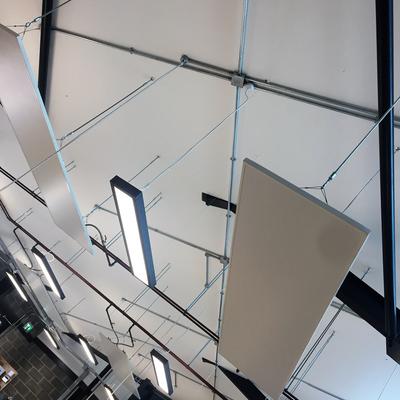
Locate an element on the screen. green illuminated sign is located at coordinates (25, 327).